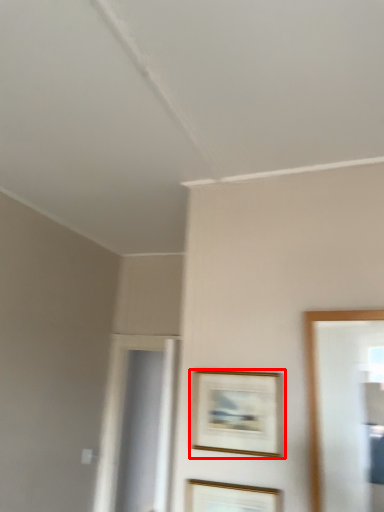
Question: From the image's perspective, considering the relative positions of picture frame (annotated by the red box) and picture frame in the image provided, where is picture frame (annotated by the red box) located with respect to the staircase?

Choices:
 (A) below
 (B) above

Answer: (B)